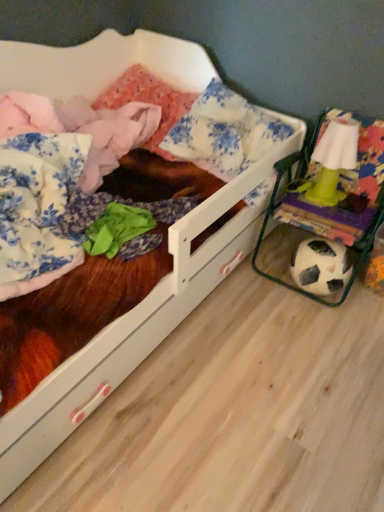
Question: Considering the relative positions of white wooden bed at center and green plastic lamp at right in the image provided, is white wooden bed at center to the left or to the right of green plastic lamp at right?

Choices:
 (A) left
 (B) right

Answer: (A)

Question: Is white wooden bed at center inside the boundaries of green plastic lamp at right, or outside?

Choices:
 (A) outside
 (B) inside

Answer: (A)

Question: In terms of size, does white wooden bed at center appear bigger or smaller than green plastic lamp at right?

Choices:
 (A) small
 (B) big

Answer: (B)

Question: Would you say green plastic lamp at right is to the left or to the right of white wooden bed at center in the picture?

Choices:
 (A) left
 (B) right

Answer: (B)

Question: From a real-world perspective, is green plastic lamp at right positioned above or below white wooden bed at center?

Choices:
 (A) below
 (B) above

Answer: (B)

Question: Is point [347, 124] closer or farther from the camera than point [170, 244]?

Choices:
 (A) closer
 (B) farther

Answer: (B)

Question: Is green plastic lamp at right taller or shorter than white wooden bed at center?

Choices:
 (A) short
 (B) tall

Answer: (A)